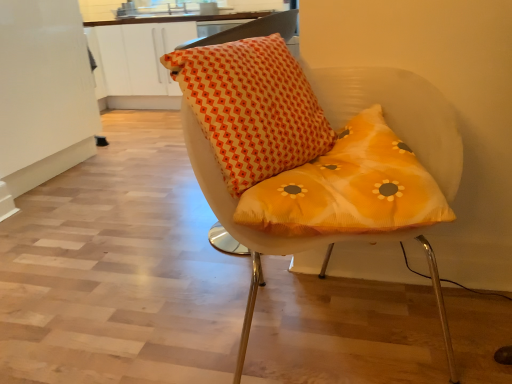
Question: From the image's perspective, is matte orange cushion at center on top of orange printed cushion at center?

Choices:
 (A) no
 (B) yes

Answer: (A)

Question: Is matte orange cushion at center not near orange printed cushion at center?

Choices:
 (A) yes
 (B) no

Answer: (B)

Question: Is matte orange cushion at center next to orange printed cushion at center?

Choices:
 (A) no
 (B) yes

Answer: (B)

Question: Can you confirm if matte orange cushion at center is smaller than orange printed cushion at center?

Choices:
 (A) no
 (B) yes

Answer: (A)

Question: Is orange printed cushion at center located within matte orange cushion at center?

Choices:
 (A) yes
 (B) no

Answer: (A)

Question: Can you confirm if matte orange cushion at center is thinner than orange printed cushion at center?

Choices:
 (A) yes
 (B) no

Answer: (B)

Question: From the image's perspective, is orange printed cushion at center above matte orange cushion at center?

Choices:
 (A) yes
 (B) no

Answer: (A)

Question: Can you confirm if orange printed cushion at center is shorter than matte orange cushion at center?

Choices:
 (A) yes
 (B) no

Answer: (A)

Question: Is orange printed cushion at center positioned beyond the bounds of matte orange cushion at center?

Choices:
 (A) yes
 (B) no

Answer: (B)

Question: Is matte orange cushion at center a part of orange printed cushion at center?

Choices:
 (A) no
 (B) yes

Answer: (A)

Question: From the image's perspective, is orange printed cushion at center under matte orange cushion at center?

Choices:
 (A) no
 (B) yes

Answer: (A)

Question: Considering the relative sizes of orange printed cushion at center and matte orange cushion at center in the image provided, is orange printed cushion at center taller than matte orange cushion at center?

Choices:
 (A) no
 (B) yes

Answer: (A)

Question: Based on their sizes in the image, would you say orange printed cushion at center is bigger or smaller than matte orange cushion at center?

Choices:
 (A) big
 (B) small

Answer: (B)